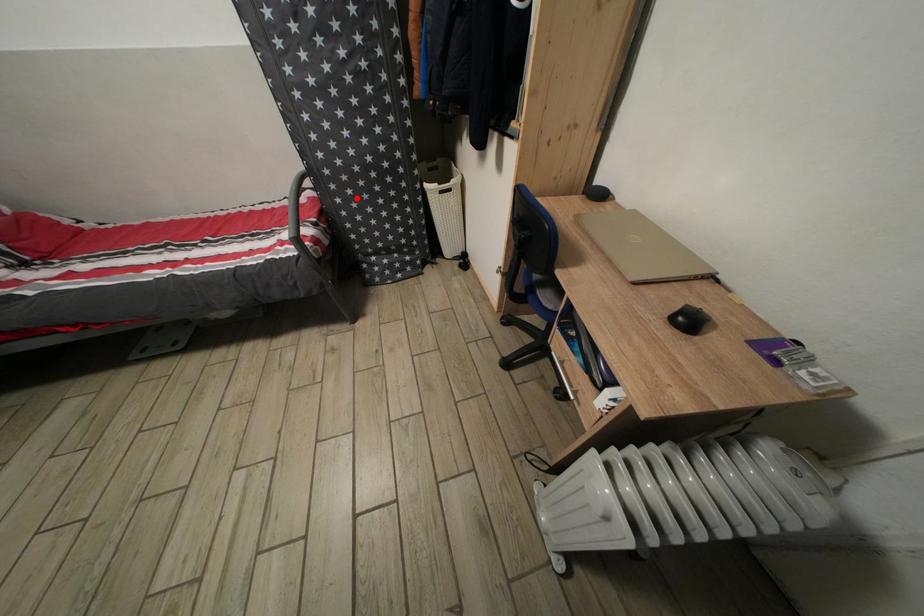
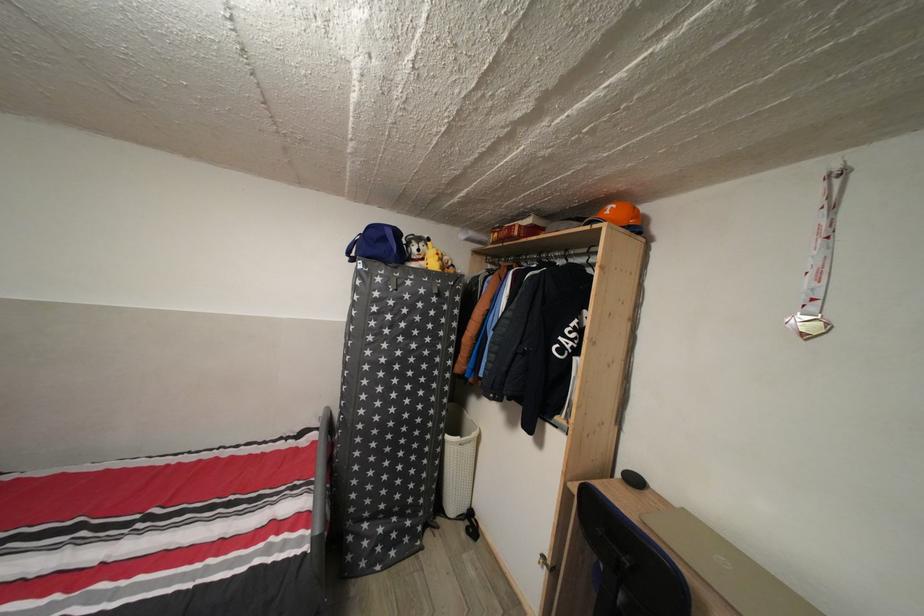
Question: A red point is marked in image1. In image2, is the corresponding 3D point closer to the camera or farther? Reply with the corresponding letter.

Choices:
 (A) The corresponding 3D point is closer.
 (B) The corresponding 3D point is farther.

Answer: (B)